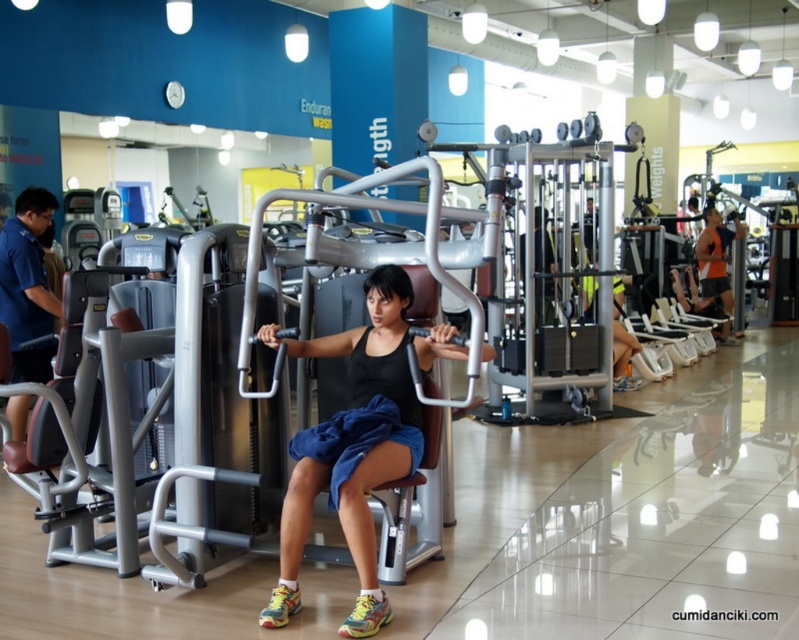
Based on the photo, can you confirm if blue fabric shirt at left is shorter than orange mesh tank top at center?

Yes.

Is point (32, 278) closer to camera compared to point (706, 284)?

Yes, it is.

At what (x,y) coordinates should I click in order to perform the action: click on blue fabric shirt at left. Please return your answer as a coordinate pair (x, y). Looking at the image, I should click on (26, 284).

Which is above, black matte tank top at center or blue fabric shirt at left?

blue fabric shirt at left is higher up.

Which is in front, point (340, 486) or point (26, 292)?

Point (340, 486)

The height and width of the screenshot is (640, 799). What are the coordinates of `black matte tank top at center` in the screenshot? It's located at (356, 442).

Who is more distant from viewer, (x=372, y=288) or (x=714, y=230)?

Point (x=714, y=230)

Does black matte tank top at center have a smaller size compared to orange mesh tank top at center?

No, black matte tank top at center is not smaller than orange mesh tank top at center.

The width and height of the screenshot is (799, 640). What do you see at coordinates (356, 442) in the screenshot?
I see `black matte tank top at center` at bounding box center [356, 442].

I want to click on black matte tank top at center, so click(x=356, y=442).